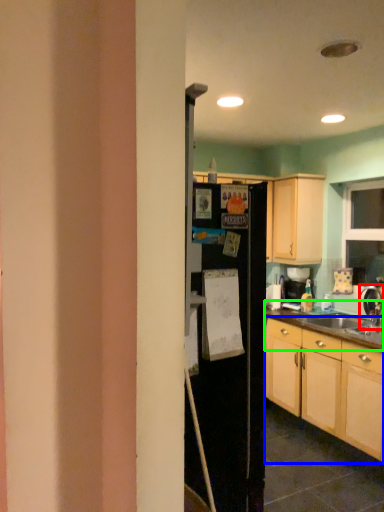
Question: Which object is positioned farthest from tap (highlighted by a red box)? Select from cabinetry (highlighted by a blue box) and countertop (highlighted by a green box).

Choices:
 (A) cabinetry
 (B) countertop

Answer: (A)